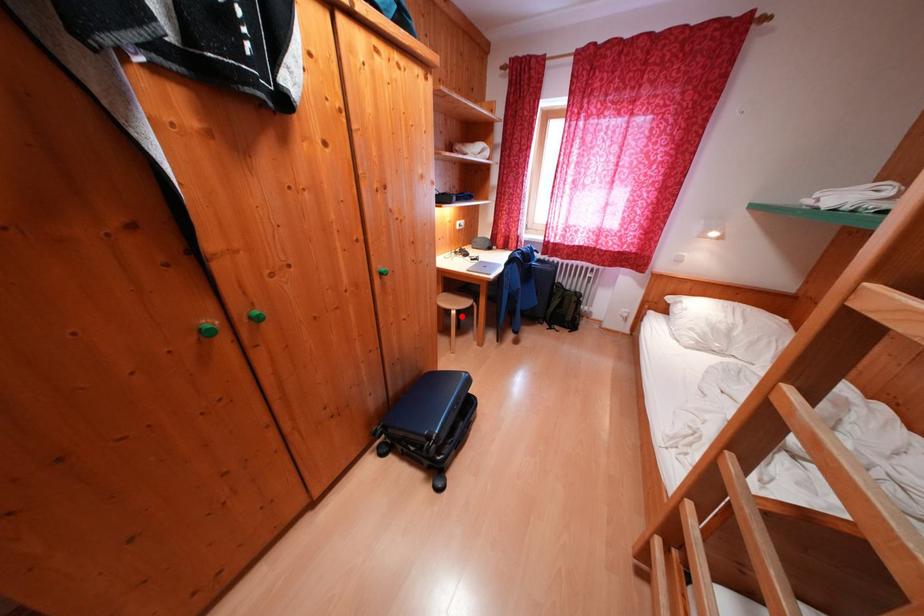
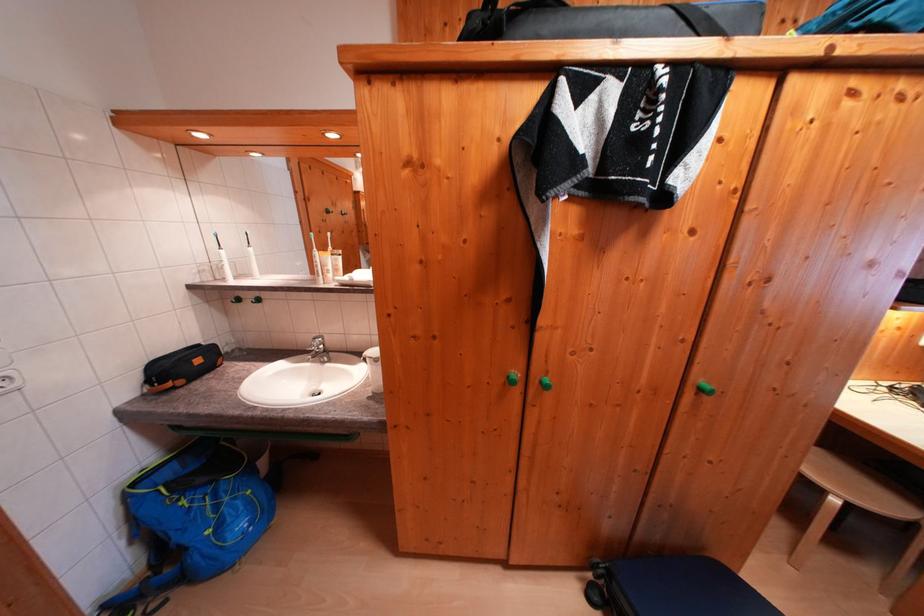
Question: I am providing you with two images of the same scene from different viewpoints. Given a red point in image1, look at the same physical point in image2. Is it:

Choices:
 (A) Closer to the viewpoint
 (B) Farther from the viewpoint

Answer: (A)